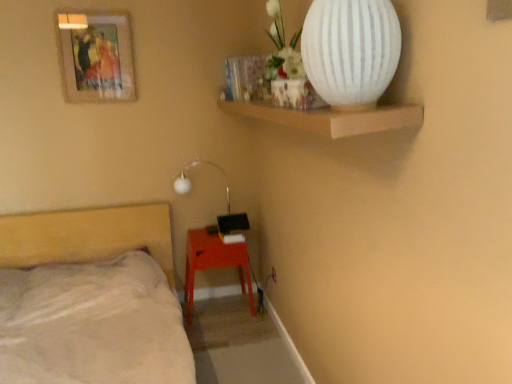
Question: Should I look upward or downward to see white matte lamp at upper center?

Choices:
 (A) up
 (B) down

Answer: (B)

Question: Does white plastic electric outlet at lower center contain white matte vase at upper right?

Choices:
 (A) yes
 (B) no

Answer: (B)

Question: From the image's perspective, is white plastic electric outlet at lower center below white matte vase at upper right?

Choices:
 (A) no
 (B) yes

Answer: (B)

Question: Is white plastic electric outlet at lower center located outside white matte vase at upper right?

Choices:
 (A) yes
 (B) no

Answer: (A)

Question: Is white plastic electric outlet at lower center bigger than white matte vase at upper right?

Choices:
 (A) no
 (B) yes

Answer: (A)

Question: Can you confirm if white plastic electric outlet at lower center is thinner than white matte vase at upper right?

Choices:
 (A) yes
 (B) no

Answer: (A)

Question: Does white plastic electric outlet at lower center lie in front of white matte vase at upper right?

Choices:
 (A) yes
 (B) no

Answer: (B)

Question: Is white plastic electric outlet at lower center positioned before wooden framed artwork at upper left?

Choices:
 (A) yes
 (B) no

Answer: (B)

Question: Are white plastic electric outlet at lower center and wooden framed artwork at upper left located far from each other?

Choices:
 (A) yes
 (B) no

Answer: (A)

Question: Are white plastic electric outlet at lower center and wooden framed artwork at upper left beside each other?

Choices:
 (A) no
 (B) yes

Answer: (A)

Question: Is white plastic electric outlet at lower center thinner than wooden framed artwork at upper left?

Choices:
 (A) no
 (B) yes

Answer: (B)

Question: Is white plastic electric outlet at lower center further to camera compared to wooden framed artwork at upper left?

Choices:
 (A) no
 (B) yes

Answer: (B)

Question: Is white plastic electric outlet at lower center oriented away from wooden framed artwork at upper left?

Choices:
 (A) yes
 (B) no

Answer: (B)

Question: From a real-world perspective, is white plastic electric outlet at lower center beneath beige fabric bed at lower left?

Choices:
 (A) no
 (B) yes

Answer: (B)